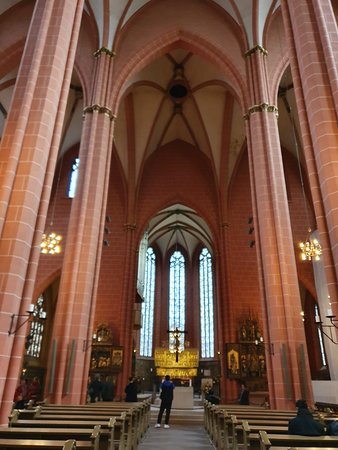
At what (x,y) coordinates should I click in order to perform the action: click on windows. Please return your answer as a coordinate pair (x, y). Image resolution: width=338 pixels, height=450 pixels. Looking at the image, I should click on (39, 333), (75, 171), (142, 270), (149, 286), (175, 291), (208, 290), (318, 333).